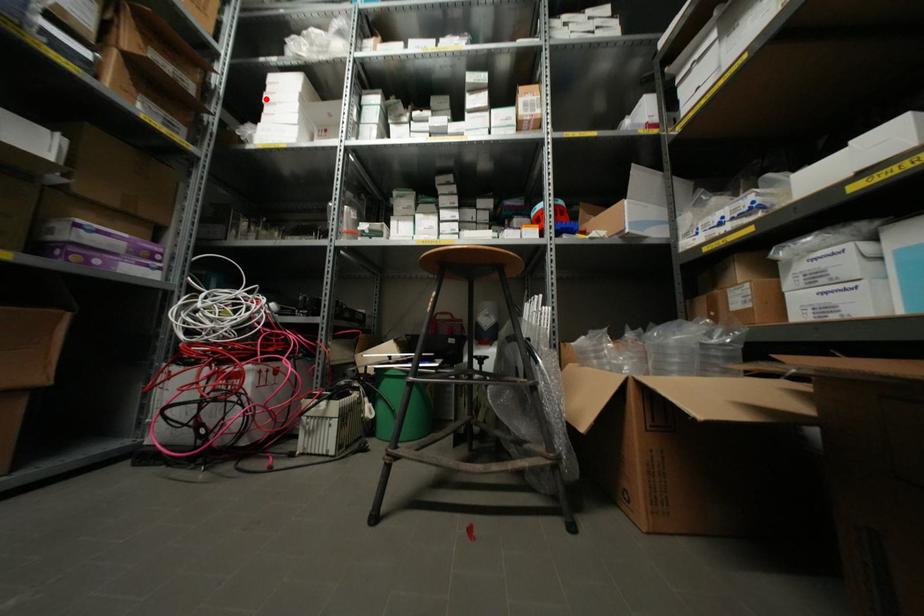
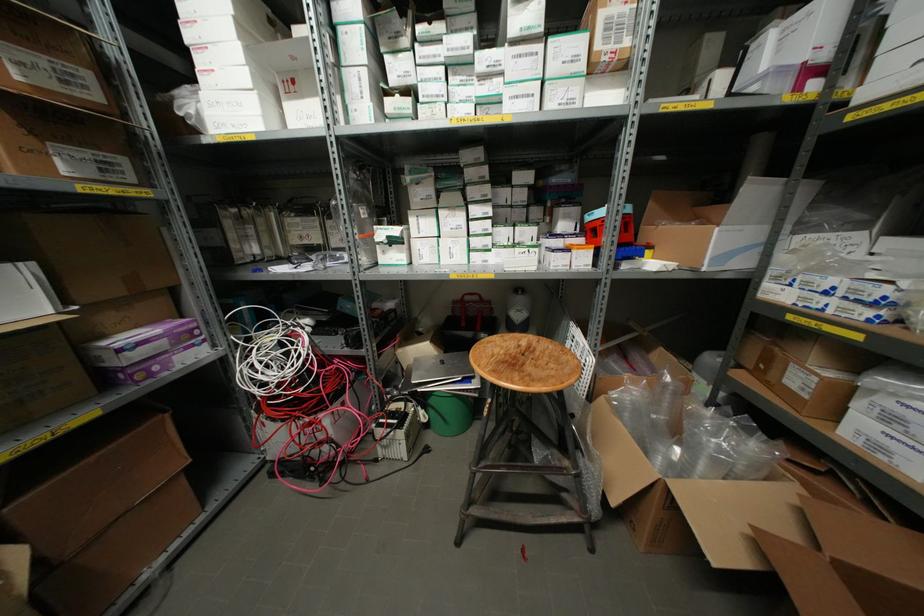
Locate, in the second image, the point that corresponds to the highlighted location in the first image.

(188, 36)